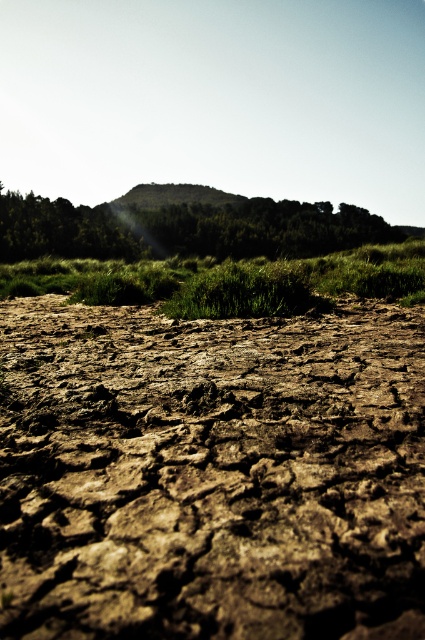
You are a gardener looking at the dry cracked earth in the foreground and the green vegetation in the midground. You notice two types of grass in the center of the image. Which one is on top of the other? The green grass at center or the green matte grass at center?

The green grass at center is positioned over green matte grass at center.

You are standing in a dry landscape with cracked earth. There are two points marked in the image. Which point is closer to you, point (328,387) or point (180,269)?

Point (328,387) is closer to the viewer than point (180,269).